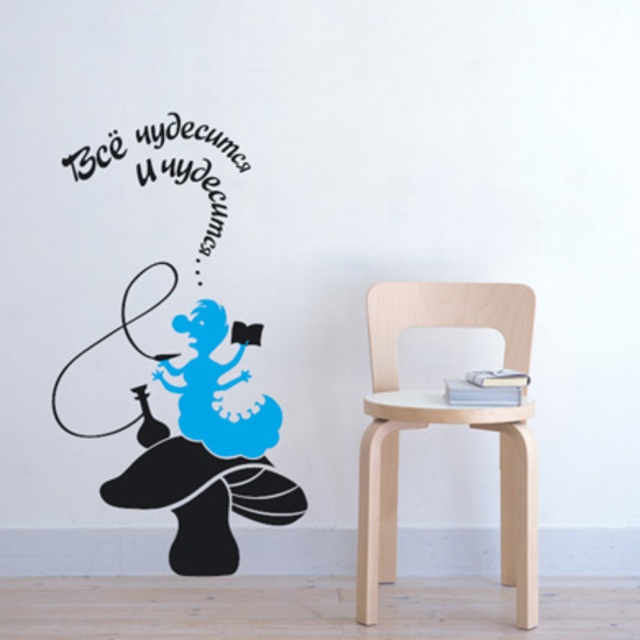
Question: Which point is closer to the camera taking this photo?

Choices:
 (A) (205, 529)
 (B) (145, 132)
 (C) (390, 570)

Answer: (C)

Question: Is birch wood chair at right to the left of black vinyl text at upper left from the viewer's perspective?

Choices:
 (A) no
 (B) yes

Answer: (A)

Question: Is blue matte figure at upper left smaller than black vinyl text at upper left?

Choices:
 (A) no
 (B) yes

Answer: (A)

Question: Which of the following is the closest to the observer?

Choices:
 (A) black vinyl text at upper left
 (B) blue matte figure at upper left
 (C) birch wood chair at right

Answer: (C)

Question: Which object is positioned closest to the black vinyl text at upper left?

Choices:
 (A) birch wood chair at right
 (B) blue matte figure at upper left

Answer: (B)

Question: Can you confirm if birch wood chair at right is positioned to the left of black vinyl text at upper left?

Choices:
 (A) no
 (B) yes

Answer: (A)